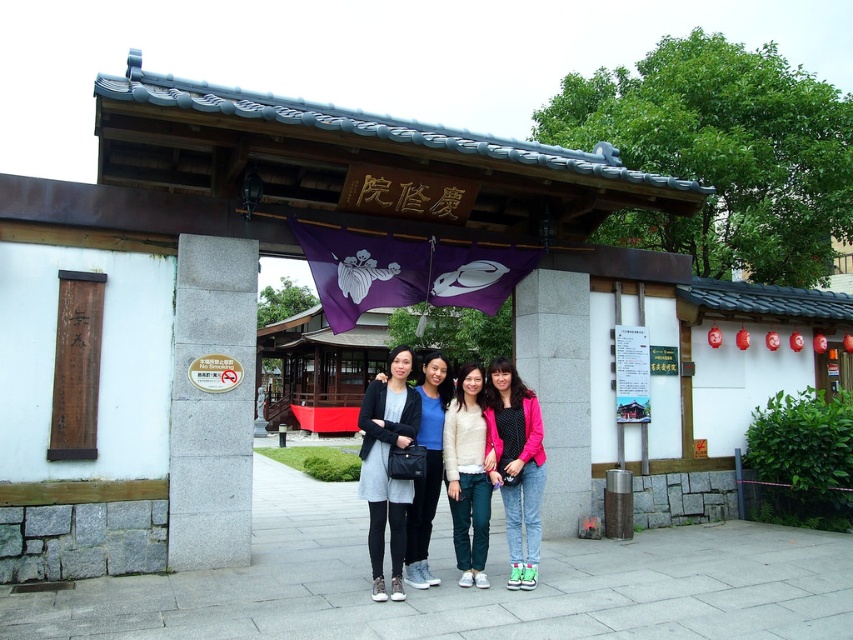
From the picture: You are a photographer taking a group photo of the pink fabric jacket at center and the white cotton sweater at center. Which person should you ask to move back slightly to ensure both are in focus?

The pink fabric jacket at center is in front of the white cotton sweater at center, so you should ask the person wearing the pink fabric jacket at center to move back slightly to ensure both are in focus.

You are a photographer trying to position a new subject exactly where the matte black dress at center was in the original photo. What are the coordinates you should aim for?

The coordinates for the matte black dress at center are at point (386, 465).

You are a photographer trying to position two markers for a group photo. The first marker is at point (x=387, y=490) and the second is at point (x=434, y=426). Which marker is closer to the camera?

Point (x=387, y=490) is in front of point (x=434, y=426), so the first marker is closer to the camera.